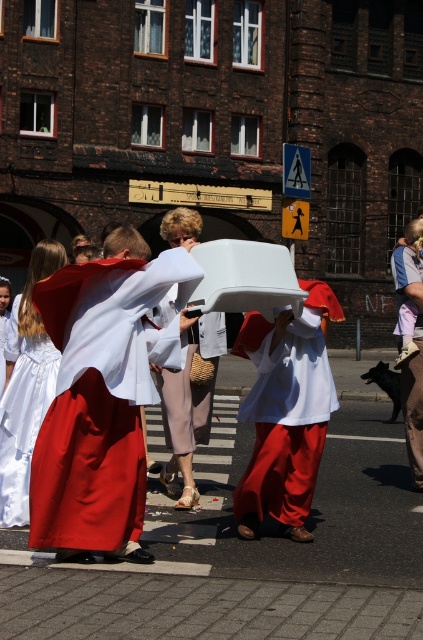
Question: Does matte white cape at center have a greater width compared to light beige fabric pants at center?

Choices:
 (A) no
 (B) yes

Answer: (B)

Question: Based on their relative distances, which object is nearer to the matte white cape at center?

Choices:
 (A) light pink fabric dress at lower right
 (B) matte white dress at center

Answer: (B)

Question: Does white satin dress at lower left have a lesser width compared to light pink fabric dress at lower right?

Choices:
 (A) no
 (B) yes

Answer: (A)

Question: Is matte white dress at center to the left of light pink fabric dress at lower right from the viewer's perspective?

Choices:
 (A) no
 (B) yes

Answer: (B)

Question: Which point appears farthest from the camera in this image?

Choices:
 (A) pos(192,218)
 (B) pos(420,480)

Answer: (B)

Question: Estimate the real-world distances between objects in this image. Which object is farther from the light pink fabric dress at lower right?

Choices:
 (A) white satin dress at lower left
 (B) matte white cape at center

Answer: (A)